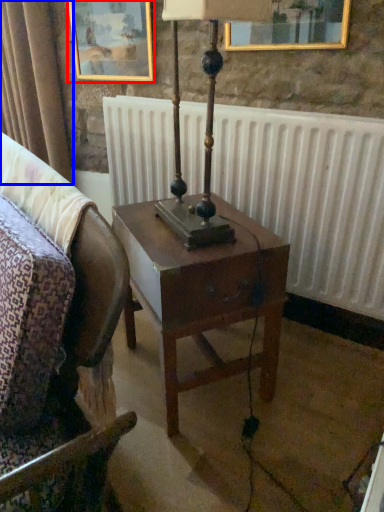
Question: Among these objects, which one is farthest to the camera, picture frame (highlighted by a red box) or curtain (highlighted by a blue box)?

Choices:
 (A) picture frame
 (B) curtain

Answer: (B)